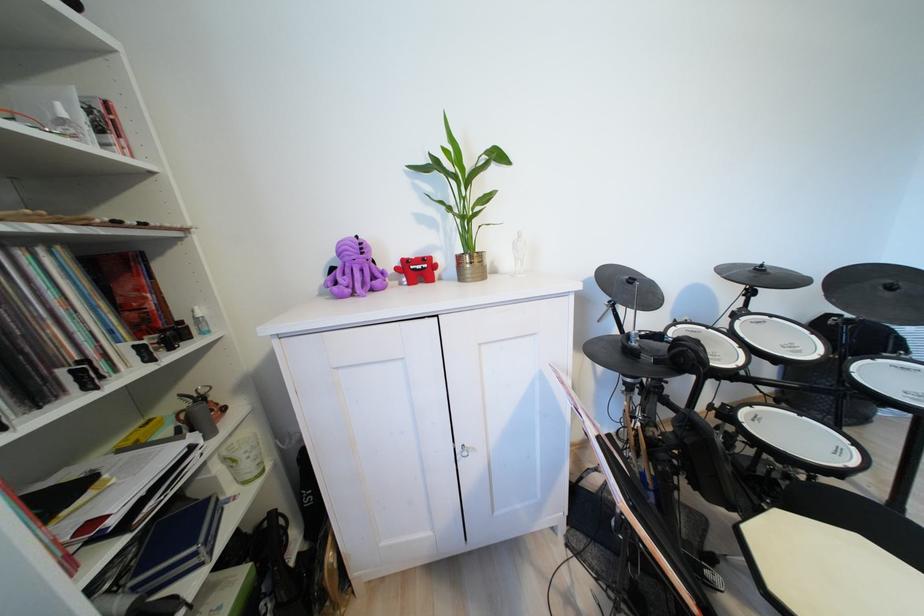
Where would you lift the black headphones? Please return your answer as a coordinate pair (x, y).

(687, 355)